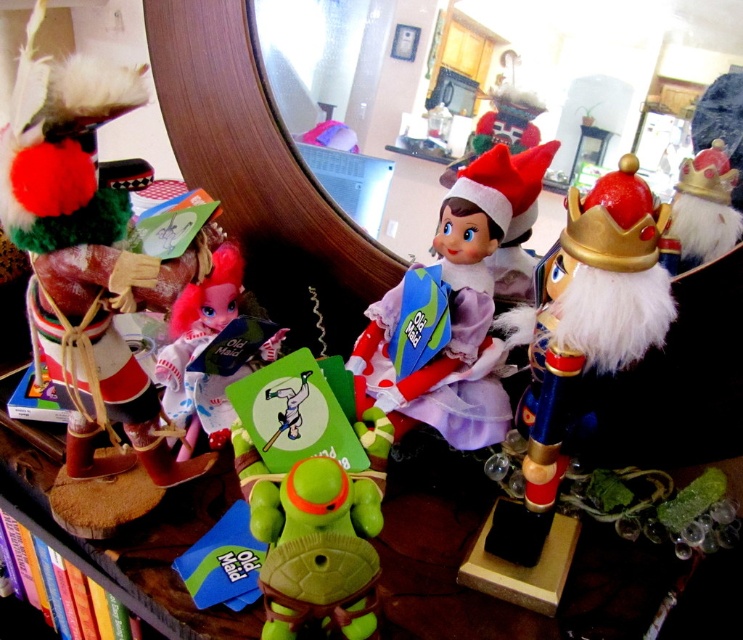
The image size is (743, 640). What do you see at coordinates (455, 307) in the screenshot?
I see `matte purple fabric doll at center` at bounding box center [455, 307].

Is point (478, 321) positioned after point (233, 308)?

That is False.

The image size is (743, 640). In order to click on matte purple fabric doll at center in this screenshot , I will do `click(455, 307)`.

You are a GUI agent. You are given a task and a screenshot of the screen. Output one action in this format:
    pyautogui.click(x=<x>, y=<y>)
    Task: Click on the matte pink fabric doll at center-left
    The image size is (743, 640).
    Given the screenshot: What is the action you would take?
    pyautogui.click(x=204, y=348)

Between matte pink fabric doll at center-left and gold metallic crown at upper right, which one is positioned lower?

matte pink fabric doll at center-left

Is point (166, 408) farther from viewer compared to point (718, 256)?

Yes, point (166, 408) is farther from viewer.

Identify the location of matte pink fabric doll at center-left. (204, 348).

Can you confirm if matte purple fabric doll at center is wider than gold metallic crown at upper right?

Yes, matte purple fabric doll at center is wider than gold metallic crown at upper right.

Does matte purple fabric doll at center have a larger size compared to gold metallic crown at upper right?

Yes.

Image resolution: width=743 pixels, height=640 pixels. What are the coordinates of `matte purple fabric doll at center` in the screenshot? It's located at (455, 307).

Image resolution: width=743 pixels, height=640 pixels. Identify the location of matte purple fabric doll at center. (455, 307).